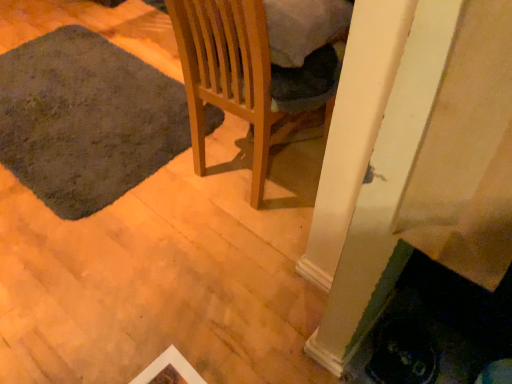
Locate an element on the screen. free spot below wooden chair at center (from a real-world perspective) is located at coordinates (244, 162).